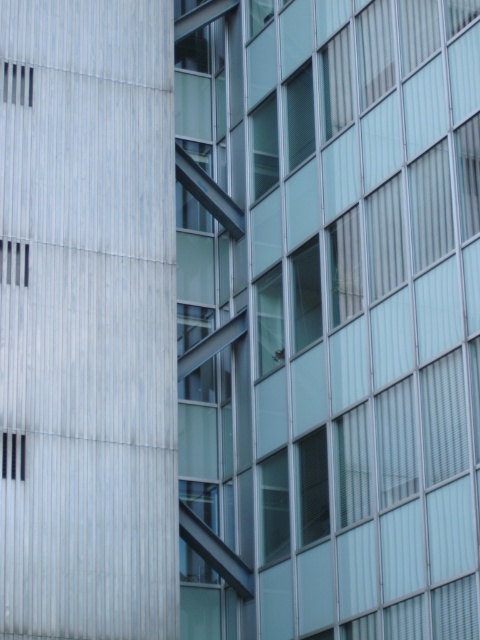
I want to click on transparent glass window at center, so click(x=332, y=316).

Which of these two, transparent glass window at center or metallic silver vent at upper left, stands taller?

transparent glass window at center

Between point (328, 525) and point (11, 273), which one is positioned behind?

Positioned behind is point (11, 273).

This screenshot has height=640, width=480. Find the location of `transparent glass window at center`. transparent glass window at center is located at coordinates (332, 316).